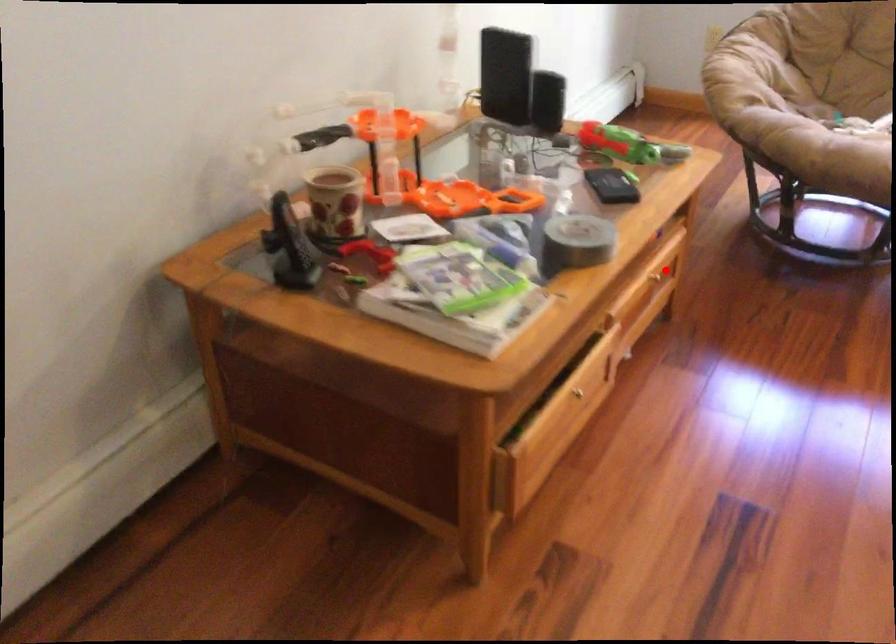
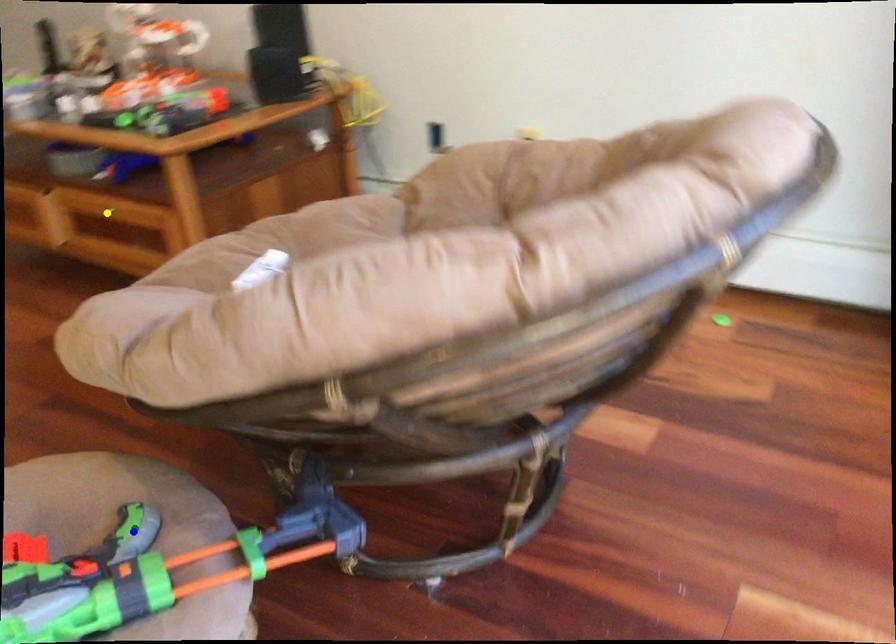
Question: I am providing you with two images of the same scene from different viewpoints. A red point is marked on the first image. You are given multiple points on the second image. Which point in image 2 is actually the same real-world point as the red point in image 1?

Choices:
 (A) green point
 (B) blue point
 (C) yellow point

Answer: (C)